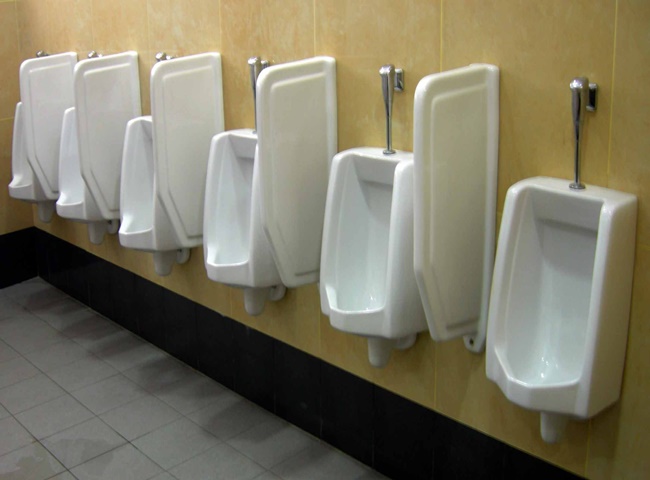
Find the location of a particular element. Image resolution: width=650 pixels, height=480 pixels. urinals is located at coordinates (547, 325), (346, 267), (229, 239), (133, 205), (70, 190), (23, 184).